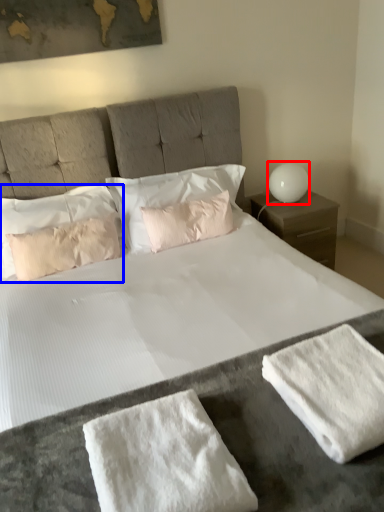
Question: Which point is further to the camera, table lamp (highlighted by a red box) or pillow (highlighted by a blue box)?

Choices:
 (A) table lamp
 (B) pillow

Answer: (A)